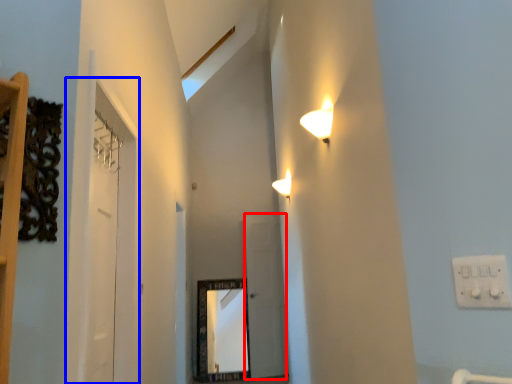
Question: Among these objects, which one is nearest to the camera, glass door (highlighted by a red box) or glass door (highlighted by a blue box)?

Choices:
 (A) glass door
 (B) glass door

Answer: (B)